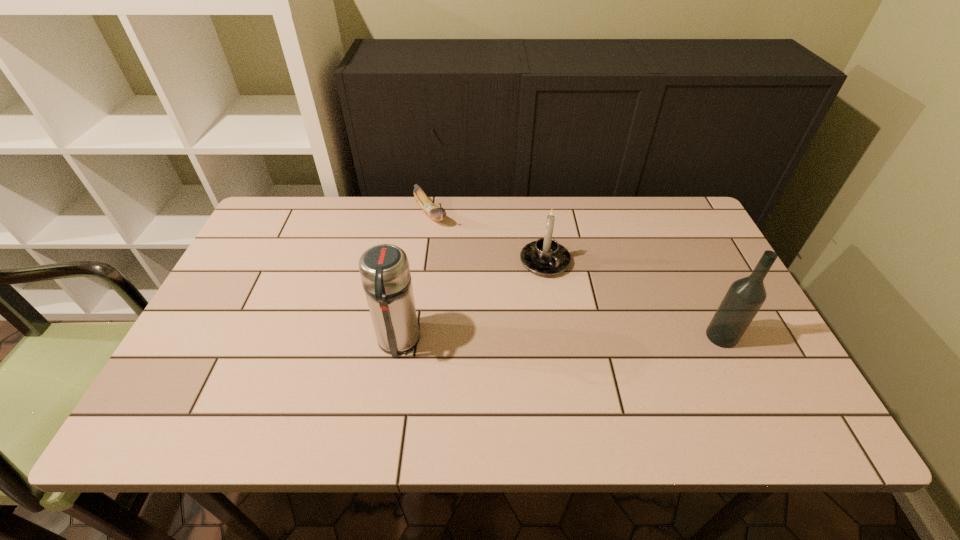
At what (x,y) coordinates should I click in order to perform the action: click on free space located at the stem of the shortest object. Please return your answer as a coordinate pair (x, y). This screenshot has height=540, width=960. Looking at the image, I should click on (467, 262).

Locate an element on the screen. The image size is (960, 540). free location located with a handle on the side of the candle holder is located at coordinates (577, 300).

This screenshot has height=540, width=960. What are the coordinates of `vacant space positioned 0.180m with a handle on the side of the candle holder` in the screenshot? It's located at (597, 325).

At what (x,y) coordinates should I click in order to perform the action: click on vacant space located with a handle on the side of the candle holder. Please return your answer as a coordinate pair (x, y). The width and height of the screenshot is (960, 540). Looking at the image, I should click on (608, 337).

Image resolution: width=960 pixels, height=540 pixels. I want to click on banana that is at the far edge, so click(x=430, y=209).

Find the location of a particular element. candle holder at the far edge is located at coordinates (546, 257).

Locate an element on the screen. object present at the near edge is located at coordinates (384, 269).

Locate an element on the screen. object present at the right edge is located at coordinates (744, 298).

The height and width of the screenshot is (540, 960). In the image, there is a desktop. What are the coordinates of `vacant region at the far edge` in the screenshot? It's located at (512, 212).

In the image, there is a desktop. Identify the location of vacant space at the near edge. (418, 386).